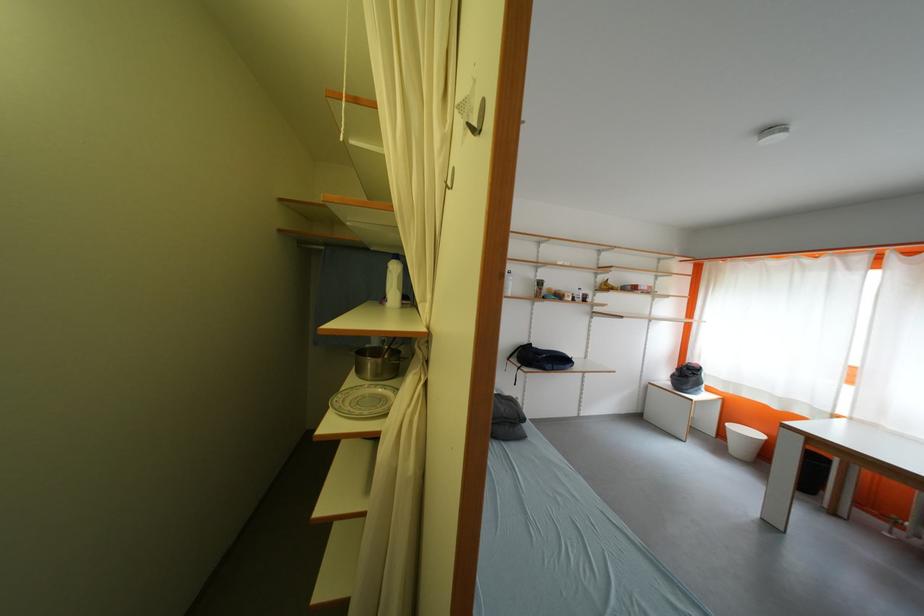
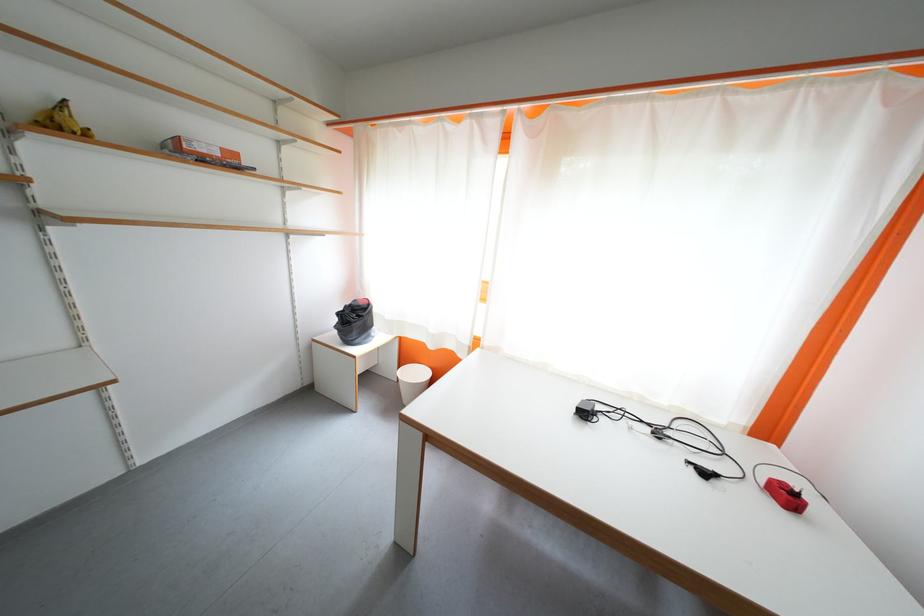
In the second image, find the point that corresponds to (687,373) in the first image.

(347, 317)